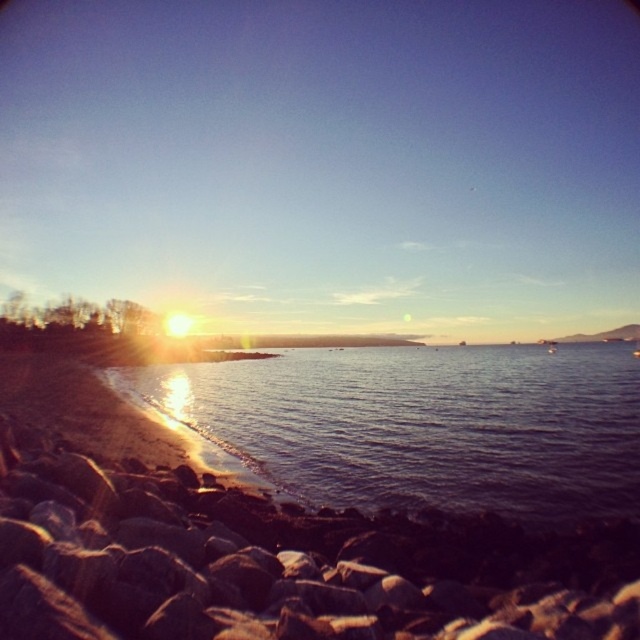
Who is higher up, smooth gray rock at lower left or shiny blue water at lower left?

smooth gray rock at lower left

Does smooth gray rock at lower left have a lesser width compared to shiny blue water at lower left?

Correct, smooth gray rock at lower left's width is less than shiny blue water at lower left's.

You are a GUI agent. You are given a task and a screenshot of the screen. Output one action in this format:
    pyautogui.click(x=<x>, y=<y>)
    Task: Click on the smooth gray rock at lower left
    The height and width of the screenshot is (640, 640).
    Given the screenshot: What is the action you would take?
    pyautogui.click(x=280, y=563)

Identify the location of smooth gray rock at lower left. The height and width of the screenshot is (640, 640). (280, 563).